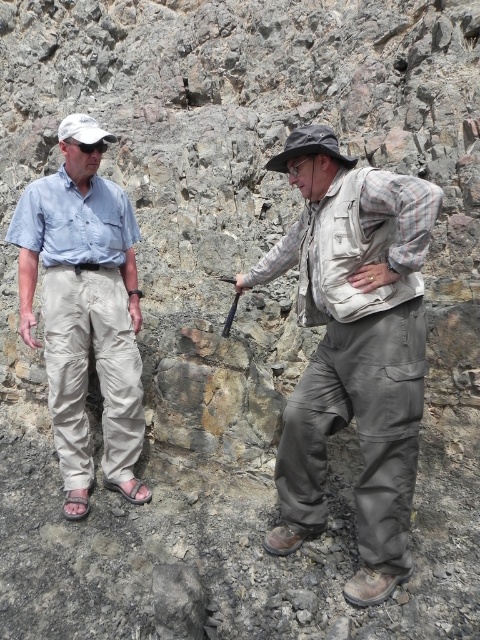
Question: Based on their relative distances, which object is nearer to the khaki cotton pants at center?

Choices:
 (A) camouflage fabric shirt at center
 (B) light blue cotton shirt at center

Answer: (A)

Question: Which of the following is the closest to the observer?

Choices:
 (A) light blue cotton shirt at center
 (B) khaki cotton pants at center
 (C) camouflage fabric shirt at center

Answer: (C)

Question: Does khaki cotton pants at center have a smaller size compared to light blue cotton shirt at center?

Choices:
 (A) yes
 (B) no

Answer: (B)

Question: Can you confirm if khaki cotton pants at center is bigger than light blue cotton shirt at center?

Choices:
 (A) yes
 (B) no

Answer: (A)

Question: Which object appears farthest from the camera in this image?

Choices:
 (A) light blue cotton shirt at center
 (B) khaki cotton pants at center
 (C) camouflage fabric shirt at center

Answer: (A)

Question: Is khaki cotton pants at center to the left of camouflage fabric shirt at center from the viewer's perspective?

Choices:
 (A) no
 (B) yes

Answer: (B)